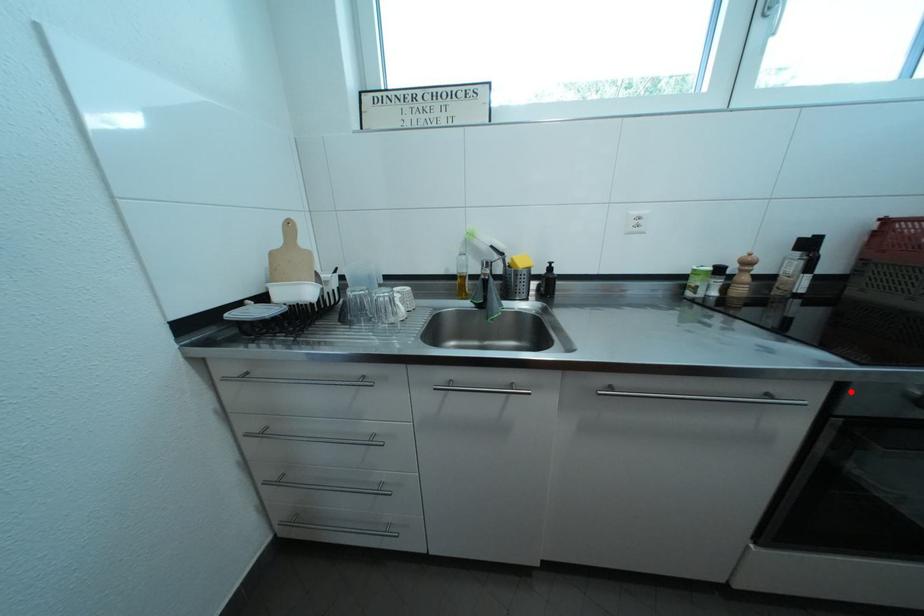
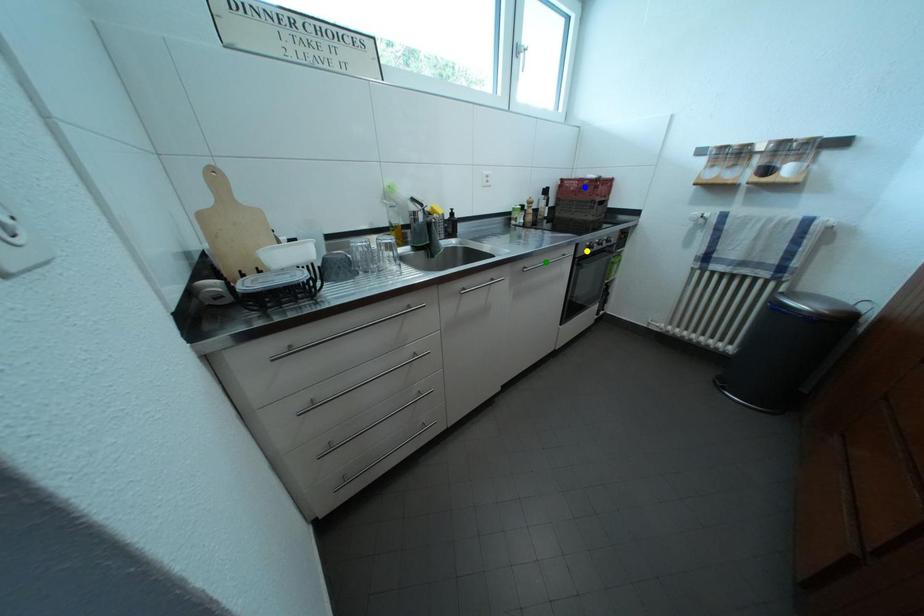
Question: I am providing you with two images of the same scene from different viewpoints. A red point is marked on the first image. You are given multiple points on the second image. Which spot in image 2 lines up with the point in image 1?

Choices:
 (A) blue point
 (B) yellow point
 (C) green point

Answer: (B)